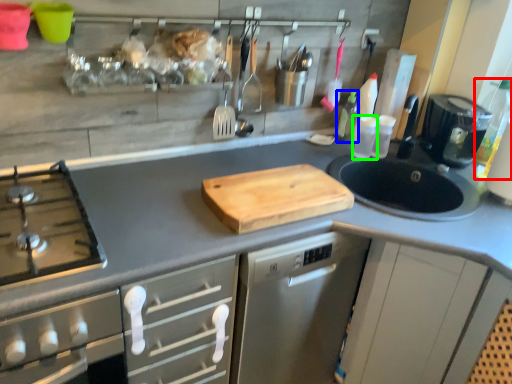
Question: Which object is the closest to the bottle (highlighted by a red box)? Choose among these: bottle (highlighted by a blue box) or bottle (highlighted by a green box).

Choices:
 (A) bottle
 (B) bottle

Answer: (B)